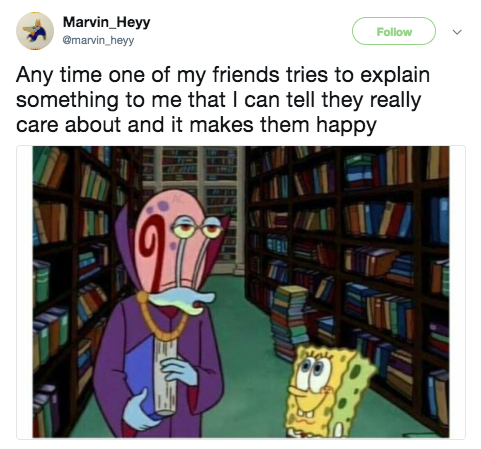
Where is `empty space in between book shelves`? This screenshot has height=449, width=481. empty space in between book shelves is located at coordinates (257, 373).